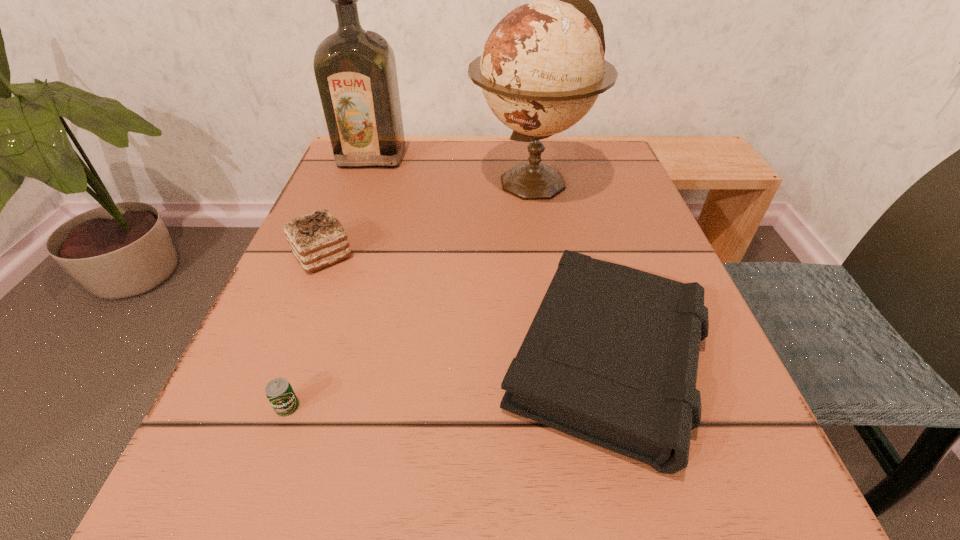
At what (x,y) coordinates should I click in order to perform the action: click on globe. Please return your answer as a coordinate pair (x, y). Looking at the image, I should click on (542, 68).

I want to click on liquor, so click(x=355, y=70).

Identify the location of chocolate cake. The image size is (960, 540). (317, 240).

At what (x,y) coordinates should I click in order to perform the action: click on Bible. Please return your answer as a coordinate pair (x, y). The image size is (960, 540). Looking at the image, I should click on (611, 357).

Identify the location of the shortest object. The image size is (960, 540). (279, 391).

Where is `free region located on the front of the globe showing Asia`? The image size is (960, 540). free region located on the front of the globe showing Asia is located at coordinates (421, 182).

The height and width of the screenshot is (540, 960). I want to click on vacant space located 0.100m on the front of the globe showing Asia, so click(x=421, y=182).

Locate an element on the screen. blank space located 0.290m on the front of the globe showing Asia is located at coordinates tap(329, 182).

You are a GUI agent. You are given a task and a screenshot of the screen. Output one action in this format:
    pyautogui.click(x=<x>, y=<y>)
    Task: Click on the free spot located on the label of the liquor
    This screenshot has width=960, height=540.
    Given the screenshot: What is the action you would take?
    pyautogui.click(x=349, y=219)

Image resolution: width=960 pixels, height=540 pixels. In order to click on vacant space situated 0.360m on the right of the third farthest object in this screenshot , I will do `click(568, 255)`.